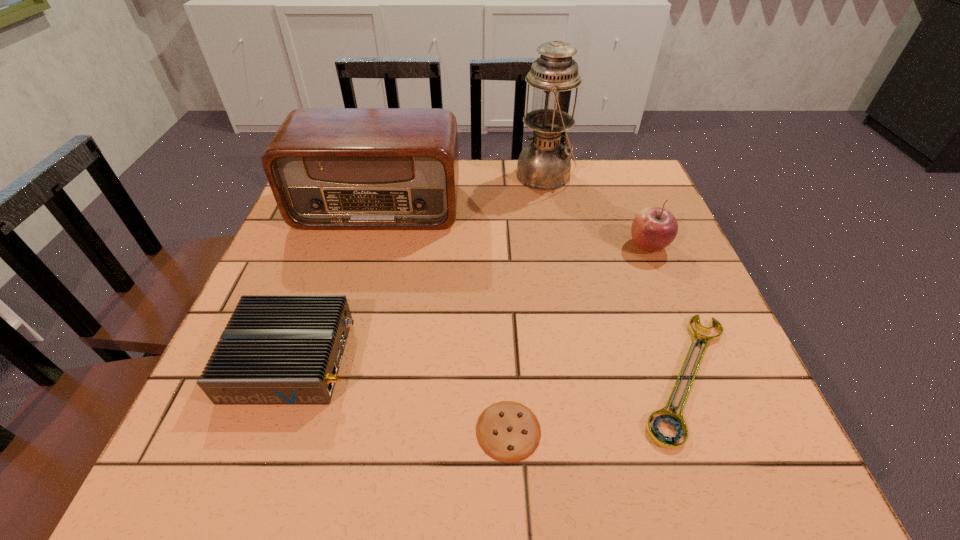
Identify the location of apple present at the right edge. This screenshot has width=960, height=540. (654, 228).

The image size is (960, 540). In order to click on wrench that is at the right edge in this screenshot , I will do `click(677, 421)`.

Find the location of `object that is at the far left corner`. object that is at the far left corner is located at coordinates (328, 168).

At what (x,y) coordinates should I click in order to perform the action: click on object that is positioned at the near right corner. Please return your answer as a coordinate pair (x, y). This screenshot has width=960, height=540. Looking at the image, I should click on (677, 421).

In the image, there is a desktop. Where is `free space at the far edge`? This screenshot has width=960, height=540. free space at the far edge is located at coordinates (516, 180).

This screenshot has height=540, width=960. Find the location of `vacant space at the near edge`. vacant space at the near edge is located at coordinates (578, 425).

Where is `free space at the left edge of the desktop`? The image size is (960, 540). free space at the left edge of the desktop is located at coordinates (350, 232).

Locate an element on the screen. vacant space at the right edge is located at coordinates click(636, 259).

Where is `free space at the far right corner`? Image resolution: width=960 pixels, height=540 pixels. free space at the far right corner is located at coordinates (623, 172).

I want to click on free space between the wrench and the third object from left to right, so tap(597, 403).